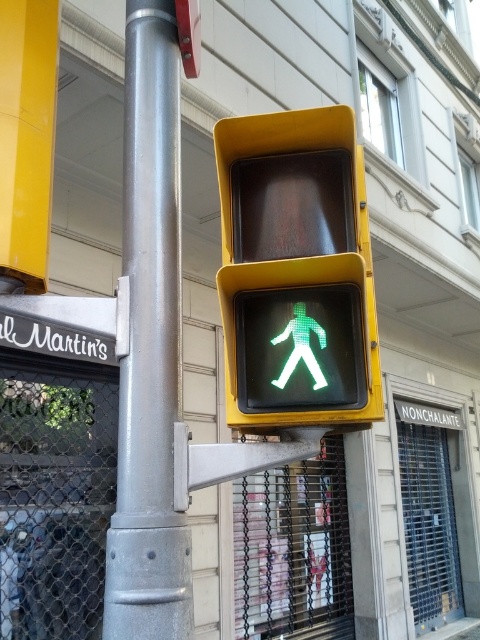
Question: Observing the image, what is the correct spatial positioning of matte yellow pedestrian signal at center in reference to silver metallic pole at center?

Choices:
 (A) below
 (B) above

Answer: (B)

Question: Which point is farther to the camera?

Choices:
 (A) silver metallic pole at center
 (B) matte yellow pedestrian signal at center

Answer: (B)

Question: Among these points, which one is farthest from the camera?

Choices:
 (A) (236, 304)
 (B) (129, 461)

Answer: (A)

Question: Is matte yellow pedestrian signal at center behind silver metallic pole at center?

Choices:
 (A) no
 (B) yes

Answer: (B)

Question: Which of the following is the farthest from the observer?

Choices:
 (A) (127, 51)
 (B) (330, 406)

Answer: (A)

Question: Is matte yellow pedestrian signal at center positioned before silver metallic pole at center?

Choices:
 (A) yes
 (B) no

Answer: (B)